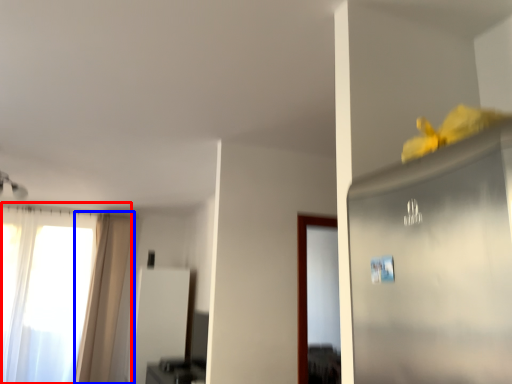
Question: Which of the following is the closest to the observer, window (highlighted by a red box) or curtain (highlighted by a blue box)?

Choices:
 (A) window
 (B) curtain

Answer: (A)